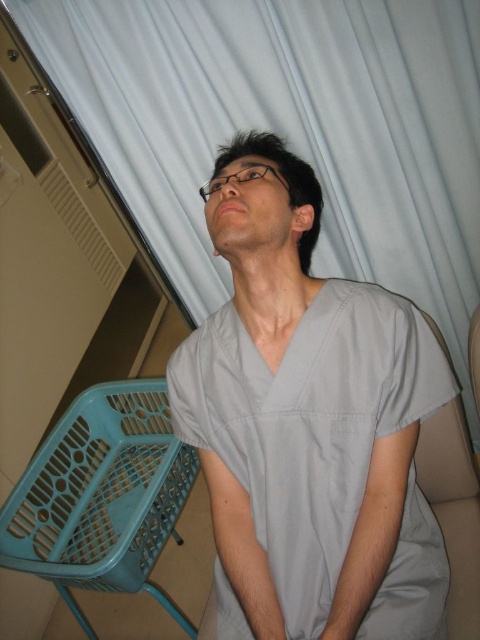
Question: Can you confirm if gray matte scrubs at center is wider than beige fabric chair at lower right?

Choices:
 (A) yes
 (B) no

Answer: (A)

Question: Is gray matte scrubs at center further to camera compared to beige fabric chair at lower right?

Choices:
 (A) no
 (B) yes

Answer: (A)

Question: Based on their relative distances, which object is farther from the gray matte scrubs at center?

Choices:
 (A) white fabric curtain at upper center
 (B) beige fabric chair at lower right

Answer: (A)

Question: Which point is farther to the camera?

Choices:
 (A) (344, 621)
 (B) (469, 547)
 (C) (367, 29)

Answer: (C)

Question: Observing the image, what is the correct spatial positioning of gray matte scrubs at center in reference to beige fabric chair at lower right?

Choices:
 (A) left
 (B) right

Answer: (A)

Question: Considering the real-world distances, which object is closest to the white fabric curtain at upper center?

Choices:
 (A) gray matte scrubs at center
 (B) beige fabric chair at lower right

Answer: (A)